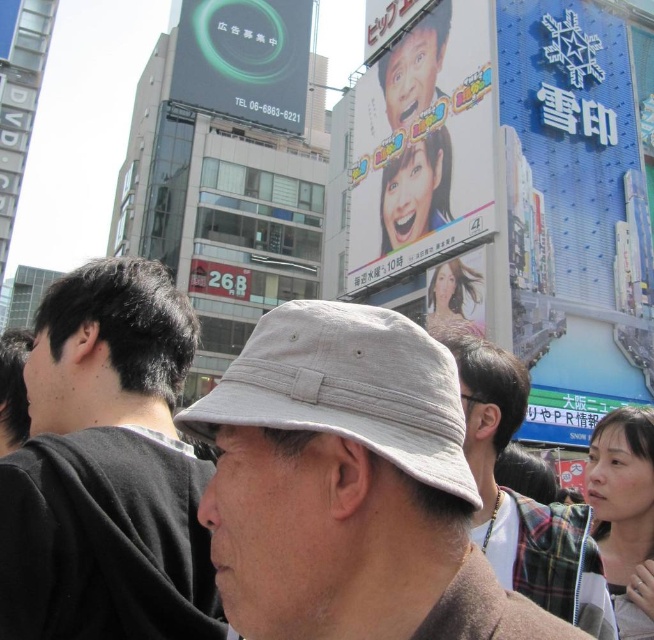
Based on the photo, you are a photographer standing in the middle of the scene. You want to take a photo of the light gray fabric hat at center and the green glossy billboard at upper left. Which object will appear larger in your photo?

The green glossy billboard at upper left will appear larger in the photo because it is taller than the light gray fabric hat at center.

You are a photographer standing 15 meters away from the light beige fabric hat at center. Can you take a clear photo of it without moving closer?

The light beige fabric hat at center is 16.54 meters away from the viewer. Since you are standing 15 meters away, you are closer than the hat, so you can take a clear photo without moving closer.